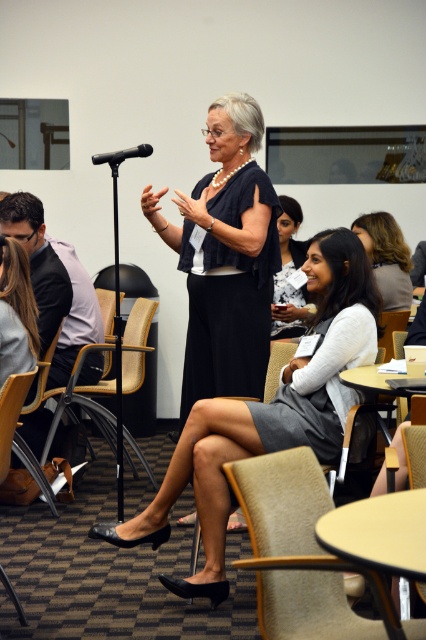
Question: Which object is farther from the camera taking this photo?

Choices:
 (A) dark brown hair at center
 (B) gray fabric skirt at center
 (C) beige fabric chair at center
 (D) gray fabric dress at center

Answer: (D)

Question: Which object is closer to the camera taking this photo?

Choices:
 (A) black plastic microphone at upper left
 (B) gray fabric dress at center
 (C) dark blue textured dress at center

Answer: (A)

Question: Can you confirm if dark brown hair at lower left is bigger than black plastic microphone at upper left?

Choices:
 (A) yes
 (B) no

Answer: (A)

Question: Among these objects, which one is farthest from the camera?

Choices:
 (A) matte black dress at center
 (B) dark brown hair at center

Answer: (B)

Question: Is brown leather chair at center below dark brown hair at center?

Choices:
 (A) yes
 (B) no

Answer: (A)

Question: Is dark blue textured dress at center closer to camera compared to black plastic microphone at upper left?

Choices:
 (A) no
 (B) yes

Answer: (A)